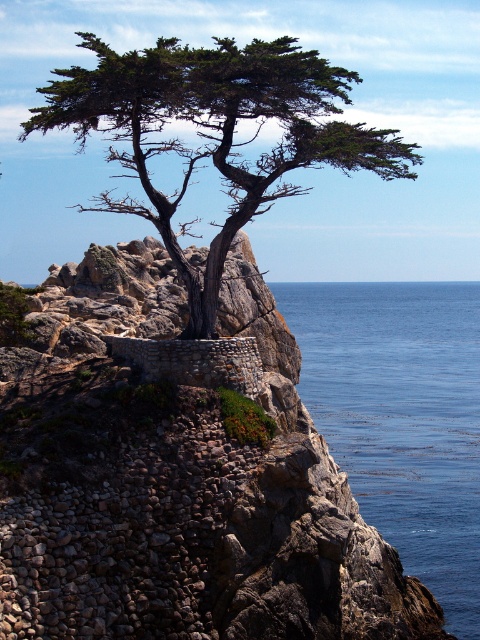
Does blue liquid water at lower right lie behind green textured cypress tree at center?

Yes, blue liquid water at lower right is behind green textured cypress tree at center.

Find the location of a particular element. Image resolution: width=480 pixels, height=640 pixels. blue liquid water at lower right is located at coordinates (400, 417).